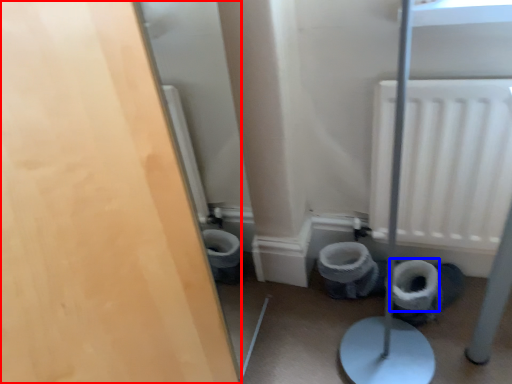
Question: Which point is closer to the camera, door (highlighted by a red box) or toilet paper (highlighted by a blue box)?

Choices:
 (A) door
 (B) toilet paper

Answer: (A)